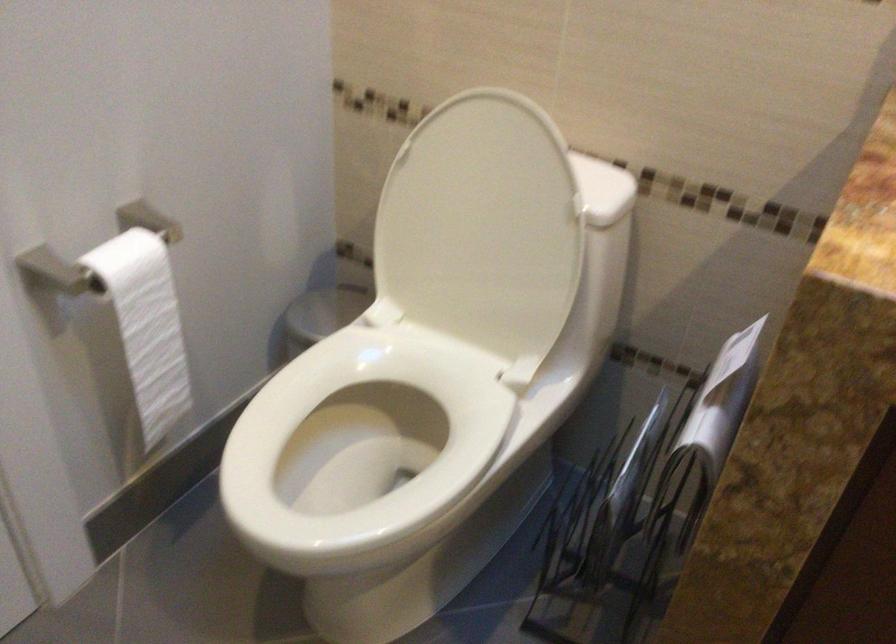
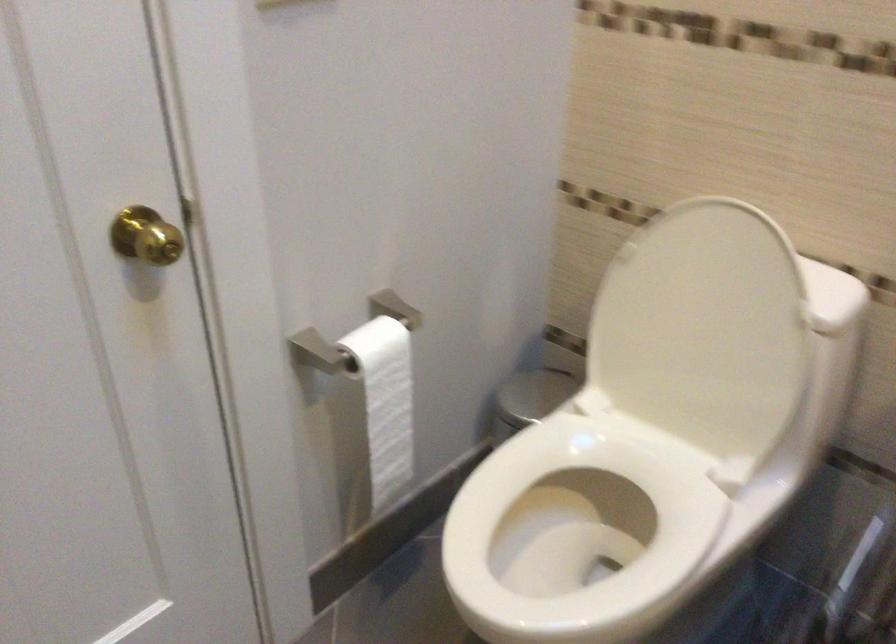
In a continuous first-person perspective shot, in which direction is the camera moving?

The movement direction of the cameraman is left, backward.